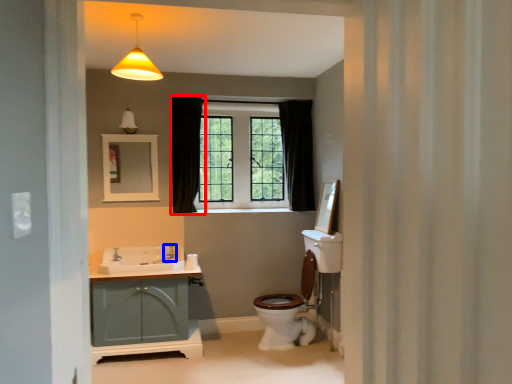
Question: Among these objects, which one is farthest to the camera, curtain (highlighted by a red box) or faucet (highlighted by a blue box)?

Choices:
 (A) curtain
 (B) faucet

Answer: (A)